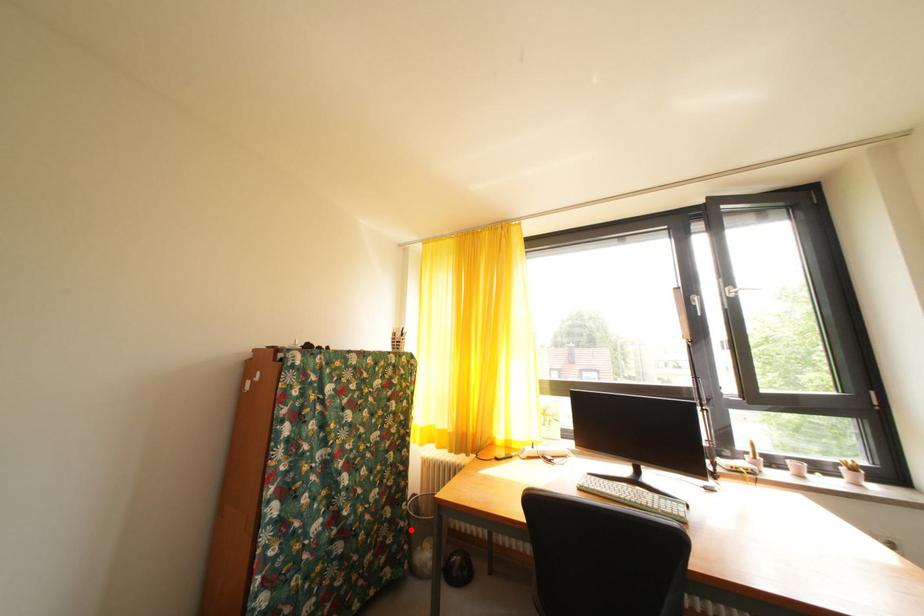
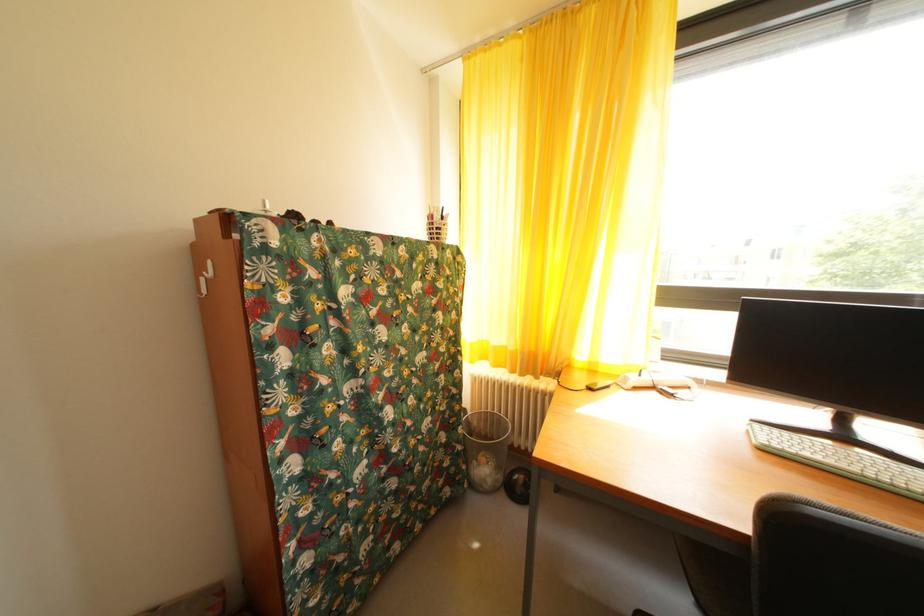
Find the pixel in the second image that matches the highlighted location in the first image.

(468, 454)